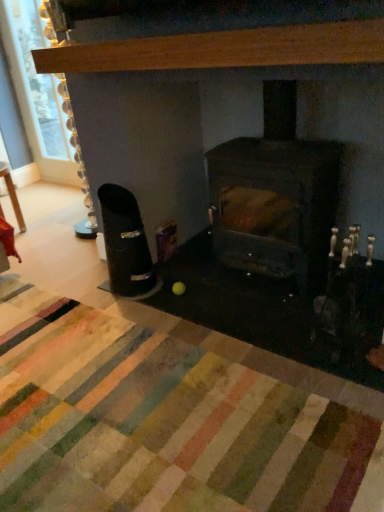
Where is `free point to the right of black plastic ashtray at left`? free point to the right of black plastic ashtray at left is located at coordinates (172, 286).